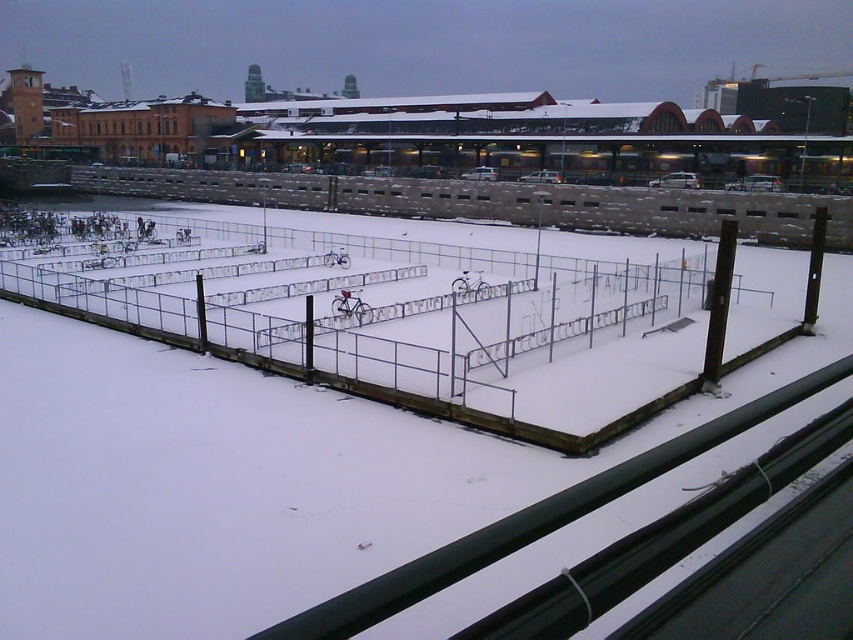
Based on the photo, you are a delivery person trying to navigate through the snowy area. You see the metallic silver fence at center and the brown concrete fence at upper center. Which fence is narrower in width?

The metallic silver fence at center has a lesser width compared to the brown concrete fence at upper center, so it is narrower.

You are standing at the center of the image and want to walk towards the metallic silver fence at center. In which direction should you walk?

Since the metallic silver fence at center is already at the center point of the image, you are already facing it directly. No need to walk in any direction other than staying where you are.